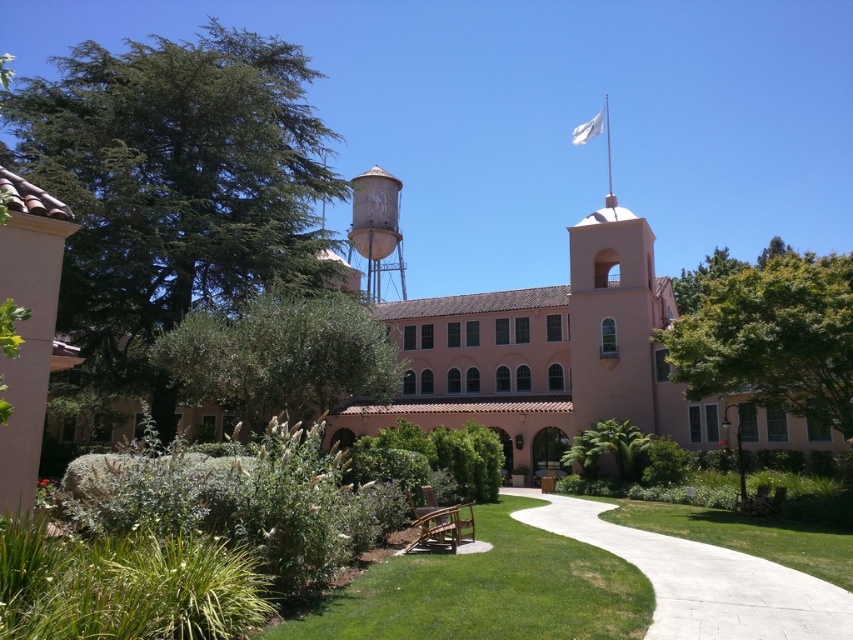
You are standing at the entrance of the large pink building and want to walk directly to the green grass at lower center. According to the coordinates provided, what are the exact coordinates you should aim for?

The exact coordinates you should aim for are point (486, 592), as that is where the green grass at lower center is located.

You are a gardener planning to water the green leafy tree at center and the green leafy bush at center. Which one should you water first if you want to start from the closest to the building?

The green leafy tree at center should be watered first because it is closer to the building than the green leafy bush at center, which is positioned behind it.

You are standing at the entrance of the large pastel pink building with a Mediterranean architectural style. You see a point at coordinates [701,579]. Where is this point located in relation to the white concrete path at lower center?

The point at [701,579] is located on the white concrete path at lower center.